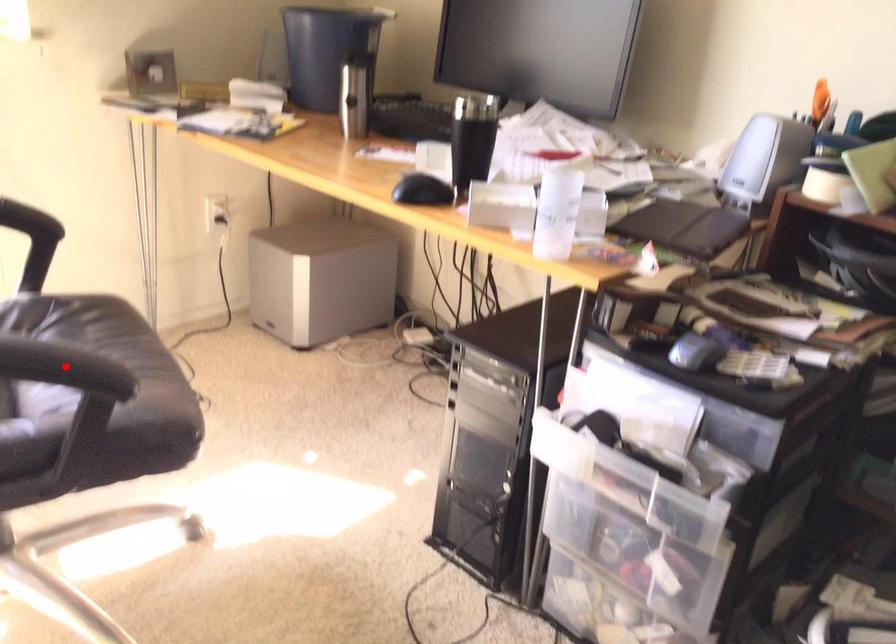
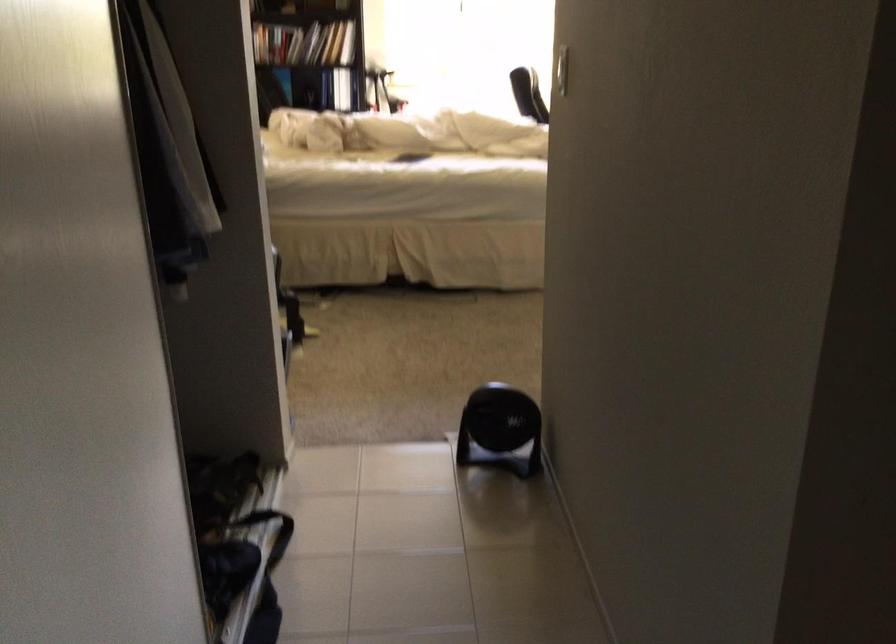
Question: I am providing you with two images of the same scene from different viewpoints. A red point is marked on the first image. At the location where the point appears in image 1, is it still visible in image 2?

Choices:
 (A) Yes
 (B) No

Answer: (B)